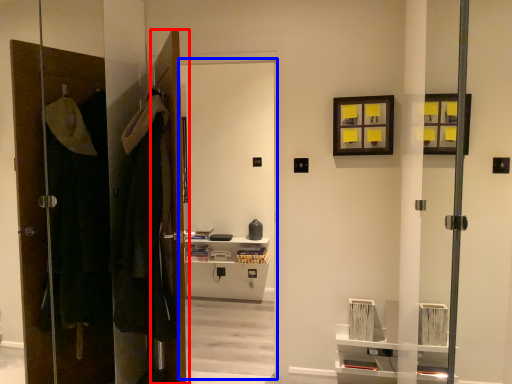
Question: Which object is closer to the camera taking this photo, door (highlighted by a red box) or screen door (highlighted by a blue box)?

Choices:
 (A) door
 (B) screen door

Answer: (A)